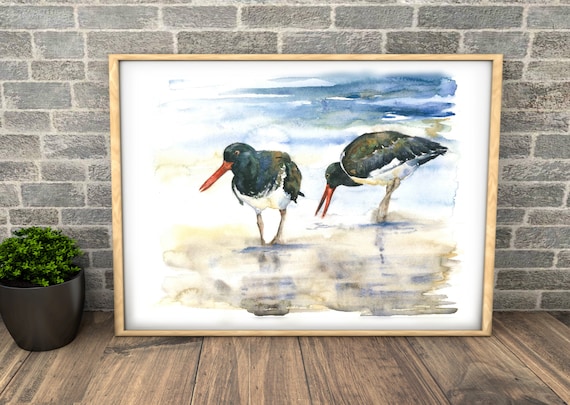
Identify the location of watercolor floor. The width and height of the screenshot is (570, 405). (328, 247).